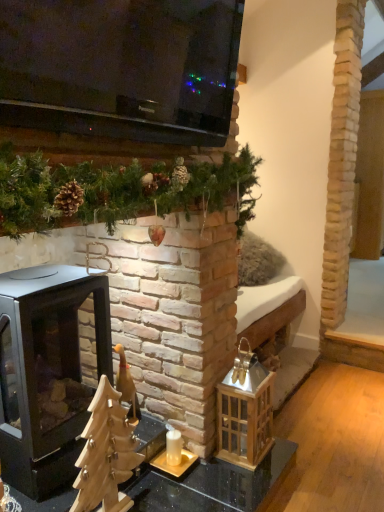
Question: In terms of width, does gold metallic candle holder at center look wider or thinner when compared to black matte wood burning stove at left?

Choices:
 (A) wide
 (B) thin

Answer: (B)

Question: From the image's perspective, is gold metallic candle holder at center above or below black matte wood burning stove at left?

Choices:
 (A) below
 (B) above

Answer: (A)

Question: Would you say gold metallic candle holder at center is to the left or to the right of black matte wood burning stove at left in the picture?

Choices:
 (A) right
 (B) left

Answer: (A)

Question: Is black matte wood burning stove at left inside the boundaries of gold metallic candle holder at center, or outside?

Choices:
 (A) inside
 (B) outside

Answer: (B)

Question: From the image's perspective, relative to gold metallic candle holder at center, is black matte wood burning stove at left above or below?

Choices:
 (A) below
 (B) above

Answer: (B)

Question: From a real-world perspective, is black matte wood burning stove at left positioned above or below gold metallic candle holder at center?

Choices:
 (A) below
 (B) above

Answer: (B)

Question: Is black matte wood burning stove at left in front of or behind gold metallic candle holder at center in the image?

Choices:
 (A) behind
 (B) front

Answer: (B)